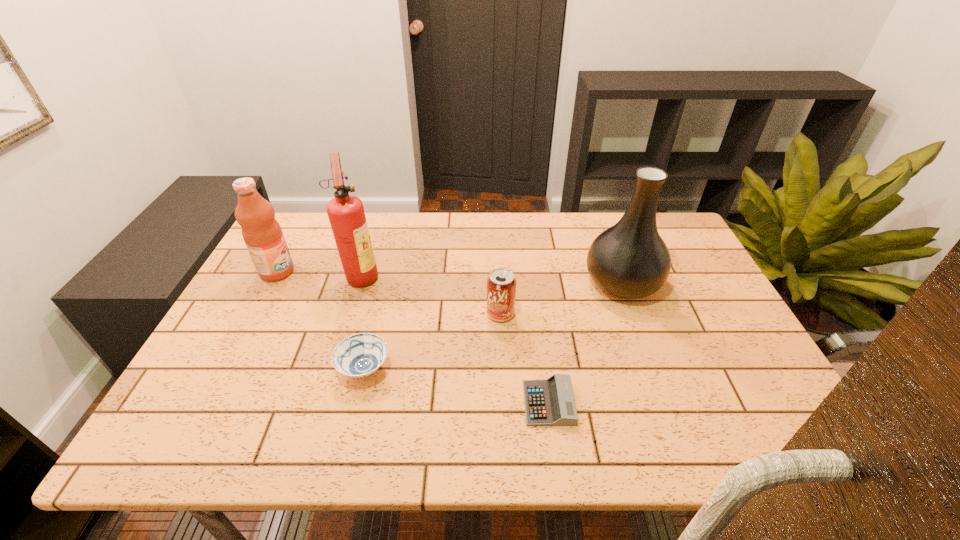
This screenshot has width=960, height=540. What are the coordinates of `vacant area that lies between the shortest object and the fourth shortest object` in the screenshot? It's located at (413, 338).

Where is `vacant space that is in between the fifth tallest object and the fruit juice`? This screenshot has width=960, height=540. vacant space that is in between the fifth tallest object and the fruit juice is located at coordinates (321, 320).

Where is `free space between the shortest object and the fourth tallest object`? The width and height of the screenshot is (960, 540). free space between the shortest object and the fourth tallest object is located at coordinates (524, 359).

Where is `object that ranks as the fifth closest to the rightmost object`? This screenshot has height=540, width=960. object that ranks as the fifth closest to the rightmost object is located at coordinates (262, 233).

Locate which object is the closest to the rightmost object. Please provide its 2D coordinates. Your answer should be formatted as a tuple, i.e. [(x, y)], where the tuple contains the x and y coordinates of a point satisfying the conditions above.

[(501, 284)]

The image size is (960, 540). Identify the location of blank space that satisfies the following two spatial constraints: 1. on the front-facing side of the fire extinguisher; 2. on the back side of the rightmost object. (360, 282).

Image resolution: width=960 pixels, height=540 pixels. I want to click on free space in the image that satisfies the following two spatial constraints: 1. on the front-facing side of the vase; 2. on the left side of the fire extinguisher, so click(360, 282).

This screenshot has width=960, height=540. I want to click on vacant space that satisfies the following two spatial constraints: 1. on the front label of the fourth shortest object; 2. on the right side of the soda can, so point(254,314).

Image resolution: width=960 pixels, height=540 pixels. I want to click on vacant region that satisfies the following two spatial constraints: 1. on the front-facing side of the fourth tallest object; 2. on the right side of the fire extinguisher, so click(350, 314).

The height and width of the screenshot is (540, 960). I want to click on free space that satisfies the following two spatial constraints: 1. on the front label of the third tallest object; 2. on the back side of the soup bowl, so click(225, 369).